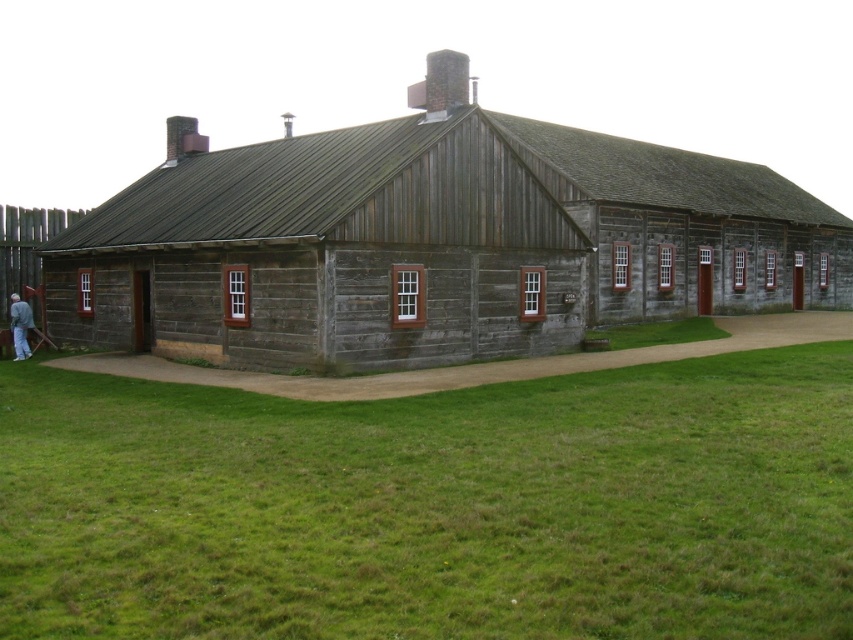
Question: Can you confirm if wooden hut at center is wider than gray fabric jacket at lower left?

Choices:
 (A) no
 (B) yes

Answer: (B)

Question: Which point appears farthest from the camera in this image?

Choices:
 (A) (83, 560)
 (B) (767, 289)
 (C) (28, 321)

Answer: (B)

Question: Which of the following is the closest to the observer?

Choices:
 (A) wooden hut at center
 (B) green grass at lower center

Answer: (B)

Question: Observing the image, what is the correct spatial positioning of green grass at lower center in reference to gray fabric jacket at lower left?

Choices:
 (A) left
 (B) right

Answer: (B)

Question: Which of the following is the farthest from the observer?

Choices:
 (A) (225, 170)
 (B) (19, 296)

Answer: (B)

Question: Can you confirm if wooden hut at center is positioned to the left of gray fabric jacket at lower left?

Choices:
 (A) yes
 (B) no

Answer: (B)